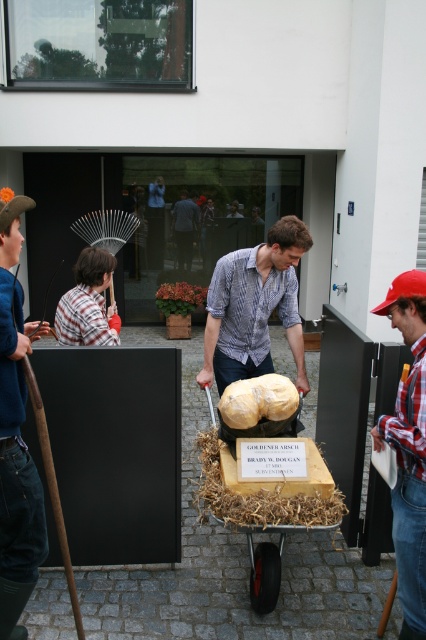
You are a delivery person who needs to ensure the yellow matte sculpture at center and the dark blue shirt at center can fit through a doorway that is 1.8 meters wide. Based on their sizes, will both items fit through the doorway together?

The yellow matte sculpture at center is smaller than the dark blue shirt at center. Since the doorway is 1.8 meters wide, both items can fit through together as long as they are arranged appropriately, considering their sizes and the available space.

You are a delivery person who needs to place a package between the matte yellow cheese at center and the yellow matte sculpture at center. The package requires a minimum of 30 inches of space. Can you fit it there?

The distance between the matte yellow cheese at center and the yellow matte sculpture at center is 27.74 inches, which is less than the required 30 inches. Therefore, the package cannot be placed there.